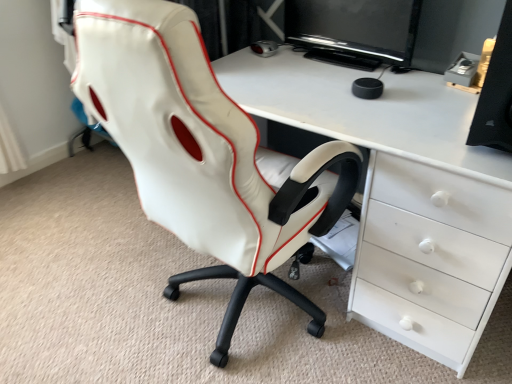
You are a GUI agent. You are given a task and a screenshot of the screen. Output one action in this format:
    pyautogui.click(x=<x>, y=<y>)
    Task: Click on the free space to the left of black matte speaker at right
    
    Given the screenshot: What is the action you would take?
    (417, 123)